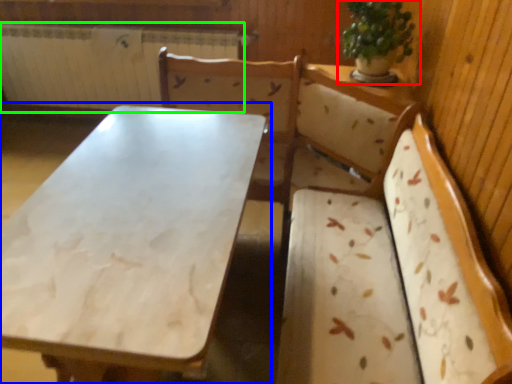
Question: Which object is the closest to the houseplant (highlighted by a red box)? Choose among these: table (highlighted by a blue box) or radiator (highlighted by a green box).

Choices:
 (A) table
 (B) radiator

Answer: (A)